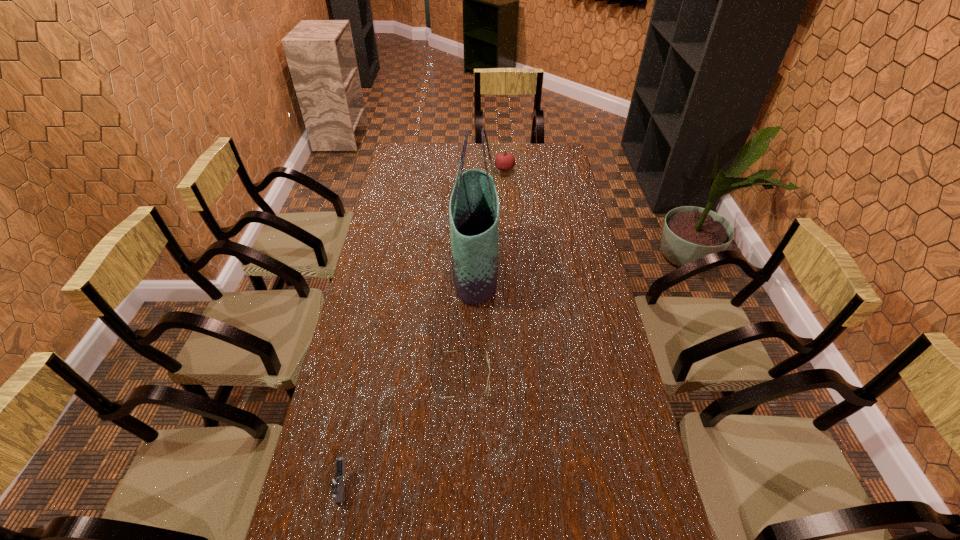
Image resolution: width=960 pixels, height=540 pixels. I want to click on the tallest object, so tap(474, 212).

Find the location of `the second farthest object`. the second farthest object is located at coordinates (474, 212).

The image size is (960, 540). Identify the location of tomato. (505, 161).

I want to click on the rightmost object, so click(505, 161).

Locate an element on the screen. The image size is (960, 540). the leftmost object is located at coordinates (336, 483).

Find the location of a particular element. Image resolution: width=960 pixels, height=540 pixels. the nearest object is located at coordinates (336, 483).

I want to click on the shortest object, so click(x=488, y=375).

Find the location of a particular element. The height and width of the screenshot is (540, 960). the second nearest object is located at coordinates click(x=488, y=375).

This screenshot has height=540, width=960. Find the location of `vacant position located 0.350m on the right of the second farthest object`. vacant position located 0.350m on the right of the second farthest object is located at coordinates (595, 268).

The image size is (960, 540). I want to click on free point located 0.090m on the right of the tomato, so click(x=535, y=169).